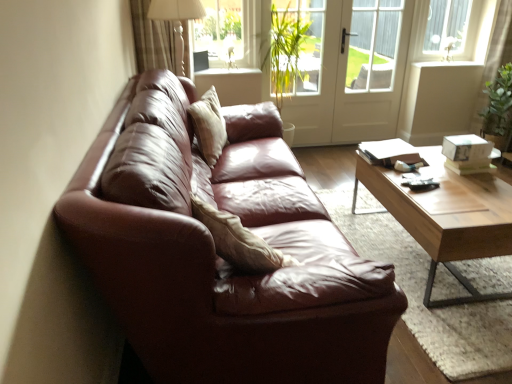
Question: Can you confirm if green leafy plant at center is wider than light brown wooden coffee table at center?

Choices:
 (A) no
 (B) yes

Answer: (A)

Question: From the image's perspective, is green leafy plant at center under light brown wooden coffee table at center?

Choices:
 (A) no
 (B) yes

Answer: (A)

Question: Is green leafy plant at center shorter than light brown wooden coffee table at center?

Choices:
 (A) no
 (B) yes

Answer: (A)

Question: Considering the relative sizes of green leafy plant at center and light brown wooden coffee table at center in the image provided, is green leafy plant at center smaller than light brown wooden coffee table at center?

Choices:
 (A) no
 (B) yes

Answer: (B)

Question: From a real-world perspective, is green leafy plant at center located higher than light brown wooden coffee table at center?

Choices:
 (A) yes
 (B) no

Answer: (A)

Question: From a real-world perspective, relative to white glossy door at center, is matte white table lamp at upper center vertically above or below?

Choices:
 (A) below
 (B) above

Answer: (B)

Question: Considering the relative positions of matte white table lamp at upper center and white glossy door at center in the image provided, is matte white table lamp at upper center to the left or to the right of white glossy door at center?

Choices:
 (A) left
 (B) right

Answer: (A)

Question: In the image, is matte white table lamp at upper center positioned in front of or behind white glossy door at center?

Choices:
 (A) behind
 (B) front

Answer: (B)

Question: Is matte white table lamp at upper center taller or shorter than white glossy door at center?

Choices:
 (A) short
 (B) tall

Answer: (A)

Question: Would you say white plastic window frame at upper right is to the left or to the right of white glossy door at center in the picture?

Choices:
 (A) right
 (B) left

Answer: (A)

Question: Is white plastic window frame at upper right wider or thinner than white glossy door at center?

Choices:
 (A) thin
 (B) wide

Answer: (B)

Question: In the image, is white plastic window frame at upper right positioned in front of or behind white glossy door at center?

Choices:
 (A) behind
 (B) front

Answer: (A)

Question: Is white plastic window frame at upper right situated inside white glossy door at center or outside?

Choices:
 (A) outside
 (B) inside

Answer: (A)

Question: Is white glossy door at center in front of or behind light brown wooden coffee table at center in the image?

Choices:
 (A) front
 (B) behind

Answer: (B)

Question: From a real-world perspective, relative to light brown wooden coffee table at center, is white glossy door at center vertically above or below?

Choices:
 (A) below
 (B) above

Answer: (B)